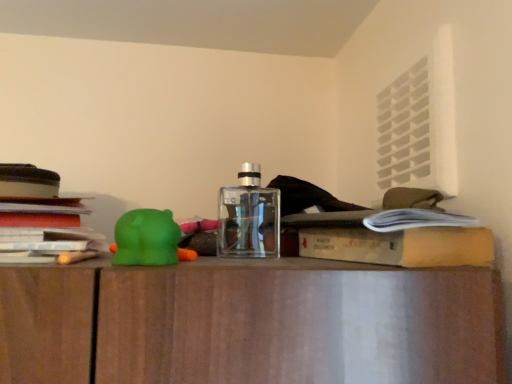
Question: Is the depth of transparent glass bottle at center greater than that of green rubber bear at left?

Choices:
 (A) no
 (B) yes

Answer: (B)

Question: Is transparent glass bottle at center turned away from green rubber bear at left?

Choices:
 (A) yes
 (B) no

Answer: (B)

Question: Considering the relative sizes of transparent glass bottle at center and green rubber bear at left in the image provided, is transparent glass bottle at center wider than green rubber bear at left?

Choices:
 (A) no
 (B) yes

Answer: (B)

Question: From the image's perspective, is transparent glass bottle at center located beneath green rubber bear at left?

Choices:
 (A) no
 (B) yes

Answer: (A)

Question: Is the position of transparent glass bottle at center less distant than that of green rubber bear at left?

Choices:
 (A) no
 (B) yes

Answer: (A)

Question: Is transparent glass bottle at center touching green rubber bear at left?

Choices:
 (A) yes
 (B) no

Answer: (B)

Question: Could you tell me if green rubber bear at left is facing stacked paper at left?

Choices:
 (A) yes
 (B) no

Answer: (B)

Question: Is stacked paper at left surrounded by green rubber bear at left?

Choices:
 (A) no
 (B) yes

Answer: (A)

Question: Is green rubber bear at left outside stacked paper at left?

Choices:
 (A) no
 (B) yes

Answer: (B)

Question: Is green rubber bear at left to the left of stacked paper at left from the viewer's perspective?

Choices:
 (A) yes
 (B) no

Answer: (B)

Question: From a real-world perspective, is green rubber bear at left over stacked paper at left?

Choices:
 (A) no
 (B) yes

Answer: (A)

Question: From a real-world perspective, is green rubber bear at left physically below stacked paper at left?

Choices:
 (A) no
 (B) yes

Answer: (B)

Question: From a real-world perspective, is transparent glass bottle at center on stacked paper at left?

Choices:
 (A) yes
 (B) no

Answer: (A)